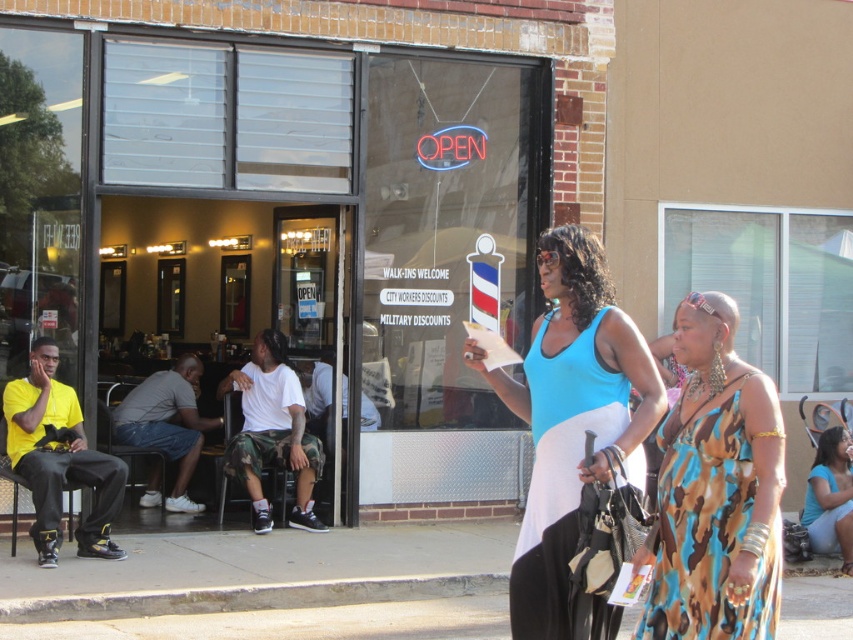
Is blue fabric dress at center smaller than camouflage print dress at right?

No, blue fabric dress at center is not smaller than camouflage print dress at right.

At what (x,y) coordinates should I click in order to perform the action: click on blue fabric dress at center. Please return your answer as a coordinate pair (x, y). Image resolution: width=853 pixels, height=640 pixels. Looking at the image, I should click on (572, 417).

Is point (525, 362) more distant than point (677, 458)?

Yes, it is.

At what (x,y) coordinates should I click in order to perform the action: click on blue fabric dress at center. Please return your answer as a coordinate pair (x, y). Looking at the image, I should click on (x=572, y=417).

Which is behind, point (758, 493) or point (554, 636)?

Positioned behind is point (554, 636).

The image size is (853, 640). In order to click on camouflage print dress at right in this screenshot , I will do `click(717, 518)`.

Does point (741, 384) lie behind point (526, 560)?

That is False.

Identify the location of camouflage print dress at right. This screenshot has width=853, height=640. (717, 518).

Is blue fabric dress at center to the left of blue jersey dress at center from the viewer's perspective?

Correct, you'll find blue fabric dress at center to the left of blue jersey dress at center.

Does blue fabric dress at center appear on the right side of blue jersey dress at center?

Incorrect, blue fabric dress at center is not on the right side of blue jersey dress at center.

You are a GUI agent. You are given a task and a screenshot of the screen. Output one action in this format:
    pyautogui.click(x=<x>, y=<y>)
    Task: Click on the blue fabric dress at center
    This screenshot has width=853, height=640.
    Given the screenshot: What is the action you would take?
    pyautogui.click(x=572, y=417)